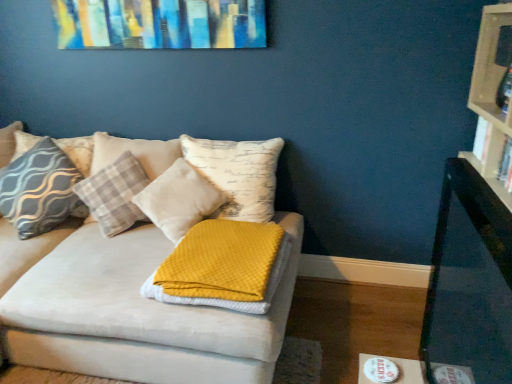
Question: Visually, is soft white pillow at center, which appears as the 1th pillow when viewed from the right, positioned to the left or to the right of hardcover book at right, which is the 1th book from front to back?

Choices:
 (A) left
 (B) right

Answer: (A)

Question: Do you think soft white pillow at center, the 3th pillow in the left-to-right sequence, is within hardcover book at right, which is the 1th book from front to back, or outside of it?

Choices:
 (A) outside
 (B) inside

Answer: (A)

Question: Which is farther from the waffle-textured yellow blanket at center?

Choices:
 (A) black glossy table at right
 (B) hardcover book at right, acting as the second book starting from the back
 (C) white paper book at right, positioned as the 2th book in front-to-back order
 (D) soft white pillow at center, which appears as the 1th pillow when viewed from the right
 (E) gray wavy-patterned pillow at left, which ranks as the 2th pillow in right-to-left order

Answer: (B)

Question: Which object is positioned farthest from the plaid fabric pillow at left, which ranks as the third pillow in right-to-left order?

Choices:
 (A) soft white pillow at center, which appears as the 1th pillow when viewed from the right
 (B) hardcover book at right, acting as the second book starting from the back
 (C) black glossy table at right
 (D) white paper book at right, positioned as the 1th book in back-to-front order
 (E) waffle-textured yellow blanket at center

Answer: (B)